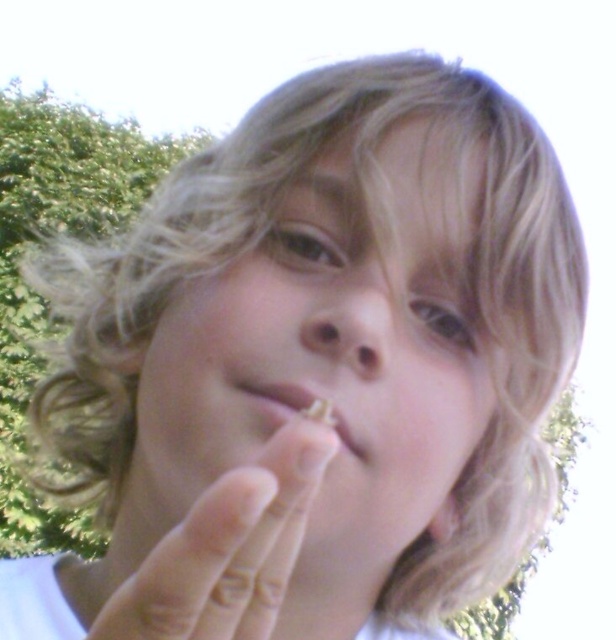
Question: Which of the following is the closest to the observer?

Choices:
 (A) (359, 326)
 (B) (354, 342)

Answer: (A)

Question: Does smooth skin finger at center have a lesser width compared to matte plastic mouth at center?

Choices:
 (A) yes
 (B) no

Answer: (B)

Question: Does smooth skin finger at center lie behind matte plastic mouth at center?

Choices:
 (A) yes
 (B) no

Answer: (B)

Question: Which object is closer to the camera taking this photo?

Choices:
 (A) smooth skin finger at center
 (B) smooth skin face at center
 (C) matte skin nose at center

Answer: (A)

Question: Is smooth skin face at center smaller than smooth skin finger at center?

Choices:
 (A) no
 (B) yes

Answer: (B)

Question: Which point is closer to the camera taking this photo?

Choices:
 (A) [383, 342]
 (B) [248, 611]
 (C) [450, 342]
 (D) [272, 390]

Answer: (B)